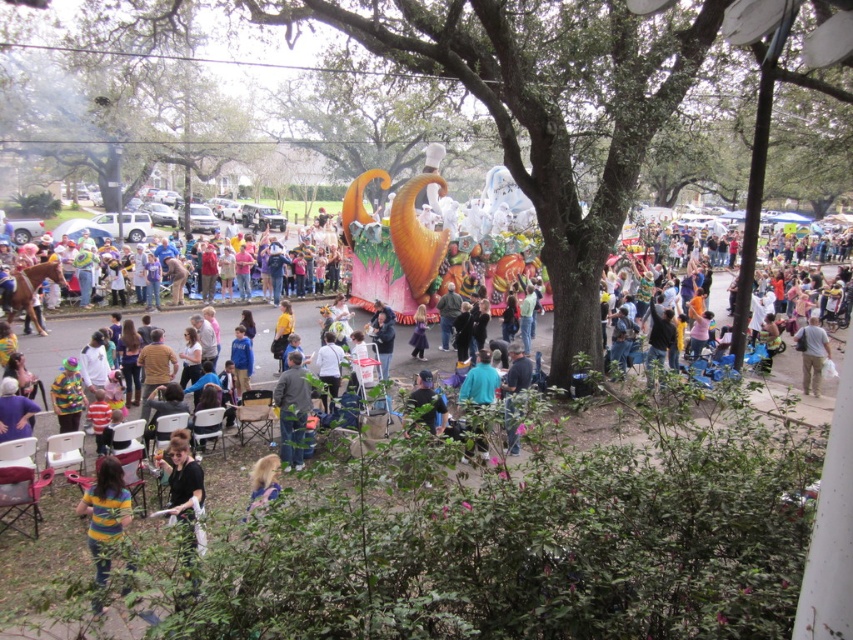
Based on the scene description, where is the green leafy tree at center located in terms of coordinates?

The green leafy tree at center is located at coordinates point (569, 104).

You are a photographer trying to capture the green leafy tree at center and the striped shirt at lower left in the same frame. Based on their positions, which object is located to the right of the other?

The green leafy tree at center is positioned on the right side of striped shirt at lower left.

You are standing in the park and want to move from the float to the edge of the crowd. You see two points marked in the image, point 1 at coordinates point (412, 260) and point 2 at coordinates point (131, 568). Which point is closer to you as you face the float?

Point 1 at coordinates point (412, 260) is closer to you because it is further to the viewer than point 2 at coordinates point (131, 568).